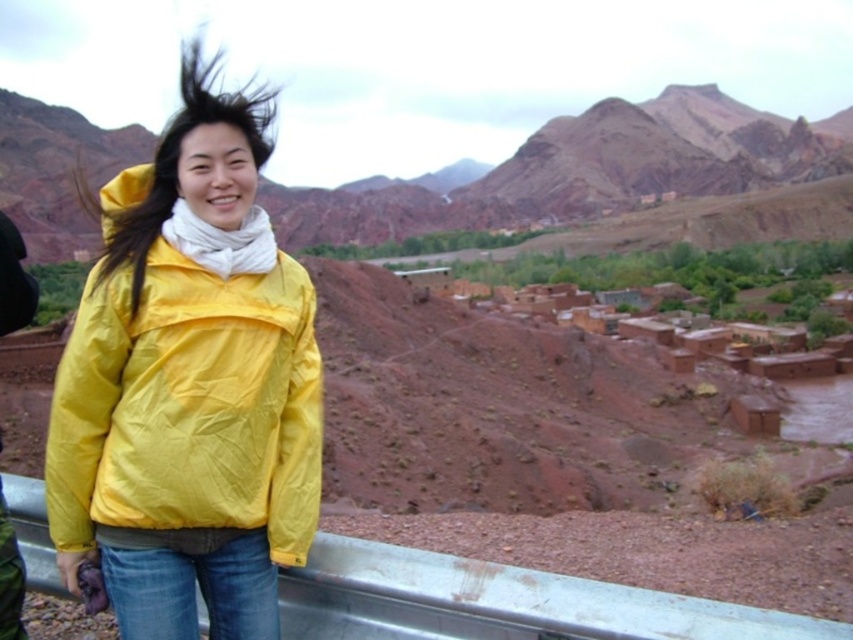
Question: Which point is closer to the camera?

Choices:
 (A) matte brown rock at upper center
 (B) metallic gray rail at lower center
 (C) brown mud-brick village at center

Answer: (B)

Question: Considering the real-world distances, which object is farthest from the brown mud-brick village at center?

Choices:
 (A) metallic gray rail at lower center
 (B) dark brown silky hair at center
 (C) matte brown rock at upper center
 (D) yellow matte jacket at center

Answer: (C)

Question: Is yellow matte jacket at center bigger than metallic gray rail at lower center?

Choices:
 (A) no
 (B) yes

Answer: (B)

Question: Is brown mud-brick village at center positioned before dark brown silky hair at center?

Choices:
 (A) yes
 (B) no

Answer: (B)

Question: Which object is positioned farthest from the dark brown silky hair at center?

Choices:
 (A) metallic gray rail at lower center
 (B) yellow matte jacket at center

Answer: (A)

Question: Can you confirm if brown mud-brick village at center is positioned above dark brown silky hair at center?

Choices:
 (A) yes
 (B) no

Answer: (B)